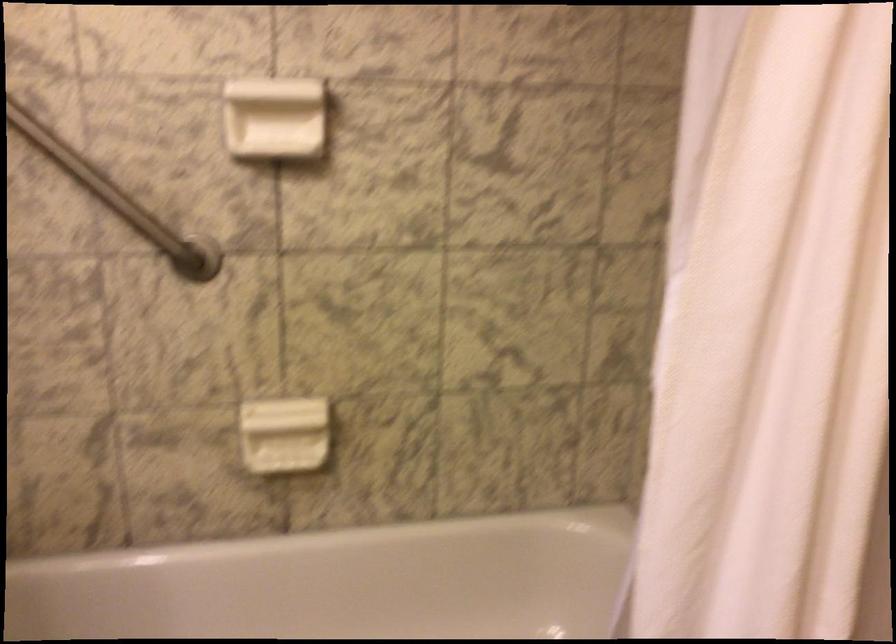
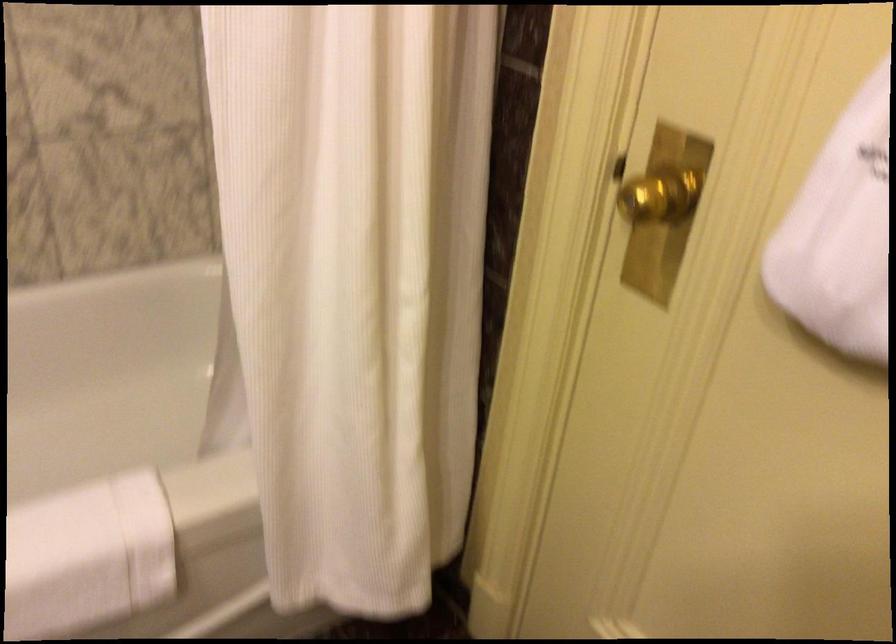
Question: Which direction would the cameraman need to move to produce the second image? Reply with the corresponding letter.

Choices:
 (A) Left
 (B) Right
 (C) Forward
 (D) Backward

Answer: (B)